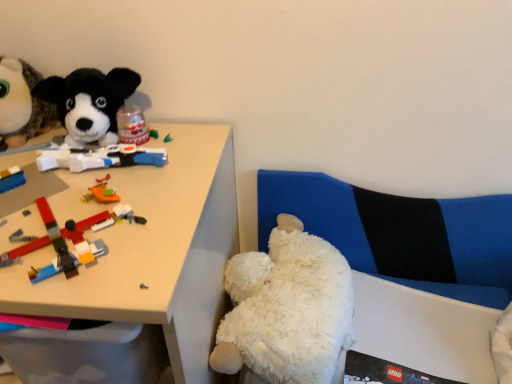
Find the location of a particular element. empty space that is ontop of white plastic desk at upper left (from a real-world perspective) is located at coordinates point(90,174).